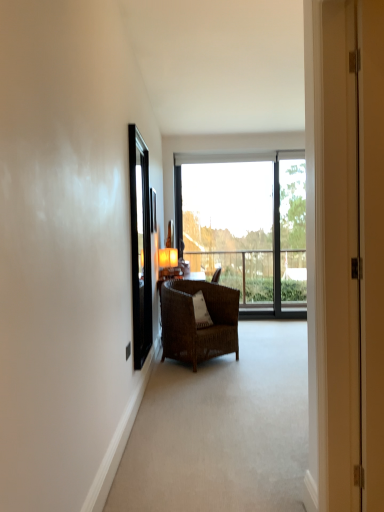
Question: Is matte orange lampshade at center surrounded by transparent glass window at center?

Choices:
 (A) yes
 (B) no

Answer: (B)

Question: Is transparent glass window at center in contact with matte orange lampshade at center?

Choices:
 (A) no
 (B) yes

Answer: (A)

Question: Is transparent glass window at center oriented away from matte orange lampshade at center?

Choices:
 (A) yes
 (B) no

Answer: (B)

Question: Considering the relative sizes of transparent glass window at center and matte orange lampshade at center in the image provided, is transparent glass window at center thinner than matte orange lampshade at center?

Choices:
 (A) no
 (B) yes

Answer: (B)

Question: Can you confirm if transparent glass window at center is bigger than matte orange lampshade at center?

Choices:
 (A) yes
 (B) no

Answer: (A)

Question: Does transparent glass window at center have a lesser height compared to matte orange lampshade at center?

Choices:
 (A) yes
 (B) no

Answer: (B)

Question: Can you see transparent glass window at center touching black glossy screen door at left?

Choices:
 (A) no
 (B) yes

Answer: (A)

Question: Does transparent glass window at center have a lesser height compared to black glossy screen door at left?

Choices:
 (A) no
 (B) yes

Answer: (A)

Question: From the image's perspective, is transparent glass window at center under black glossy screen door at left?

Choices:
 (A) no
 (B) yes

Answer: (A)

Question: Can black glossy screen door at left be found inside transparent glass window at center?

Choices:
 (A) yes
 (B) no

Answer: (B)

Question: Is transparent glass window at center at the left side of black glossy screen door at left?

Choices:
 (A) yes
 (B) no

Answer: (B)

Question: Is transparent glass window at center looking in the opposite direction of black glossy screen door at left?

Choices:
 (A) no
 (B) yes

Answer: (A)

Question: Is matte white door at center thinner than matte orange lampshade at center?

Choices:
 (A) no
 (B) yes

Answer: (B)